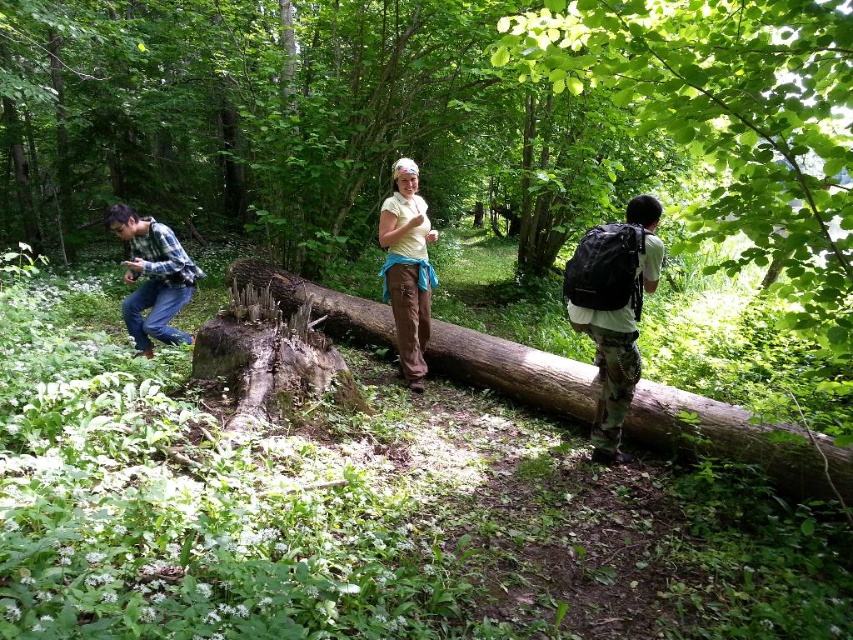
Question: Can you confirm if yellow t-shirt at center is positioned above camouflage pants at center?

Choices:
 (A) no
 (B) yes

Answer: (B)

Question: Which of these objects is positioned farthest from the brushed metal camera at left?

Choices:
 (A) camouflage pants at center
 (B) brown rough log at center

Answer: (A)

Question: Is yellow t-shirt at center below brushed metal camera at left?

Choices:
 (A) yes
 (B) no

Answer: (A)

Question: Which point is closer to the camera?

Choices:
 (A) yellow matte shirt at center
 (B) camouflage pants at center

Answer: (B)

Question: Can you confirm if brown rough log at center is positioned to the left of camouflage pants at center?

Choices:
 (A) yes
 (B) no

Answer: (A)

Question: Which object is the farthest from the brown rough log at center?

Choices:
 (A) yellow t-shirt at center
 (B) camouflage pants at center
 (C) brushed metal camera at left
 (D) yellow matte shirt at center

Answer: (A)